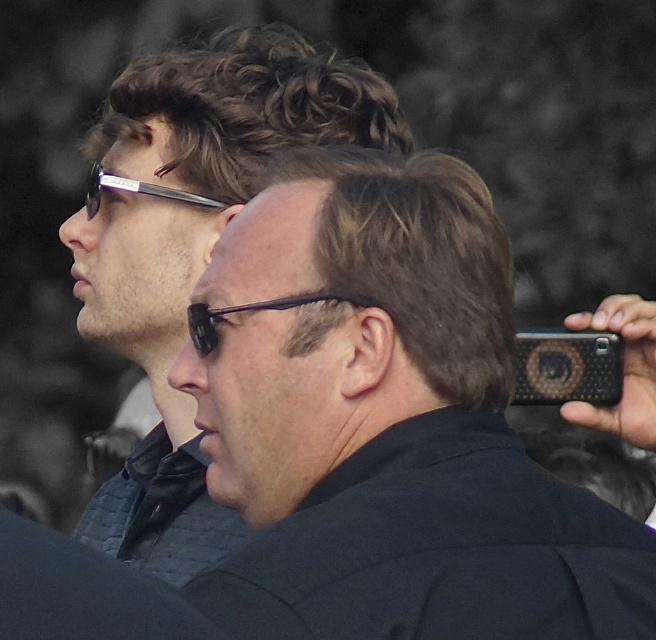
You are standing in front of the two people in the image. Based on their positions relative to you, which point, point [146,515] or point [310,300], is farther away from you?

Point [146,515] is farther away from you because it is behind point [310,300].

What are the coordinates of the matte black sunglasses at upper left?

The matte black sunglasses at upper left is located at point (192, 250).

You are a photographer taking a picture of the two people in the scene. You notice the matte black sunglasses at upper left and the black plastic glasses at center. Which object is closer to the camera?

The matte black sunglasses at upper left is closer to the camera because the black plastic glasses at center is behind it.